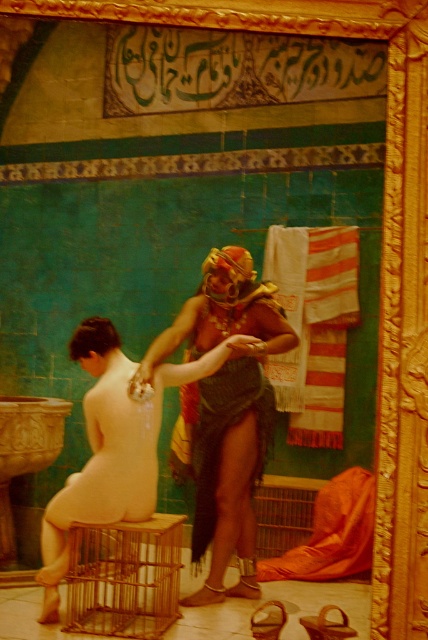
You are a visitor in this bathhouse and you see the matte brown skin at center and the dark green textured cloth at center. Which one is bigger in size?

The matte brown skin at center is larger in size compared to the dark green textured cloth at center.

In the traditional bathhouse scene, there is a person with matte brown skin at center and a striped cotton towel at center. From the perspective of someone facing the person, which object is more to the left?

The matte brown skin at center is positioned on the left side of striped cotton towel at center, so it is more to the left.